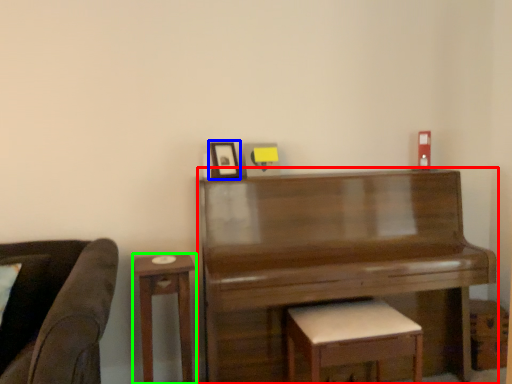
Question: Which is farther away from piano (highlighted by a red box)? picture frame (highlighted by a blue box) or table (highlighted by a green box)?

Choices:
 (A) picture frame
 (B) table

Answer: (A)